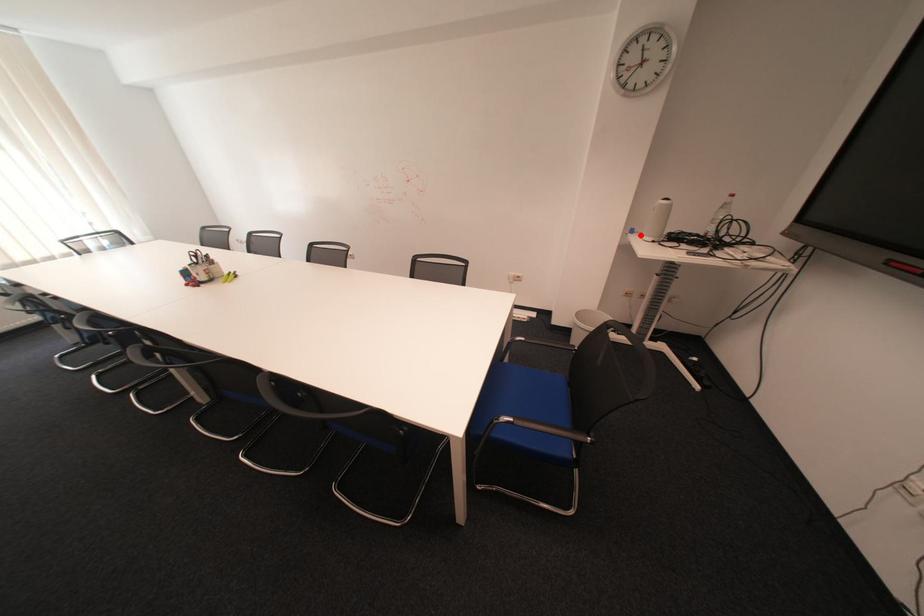
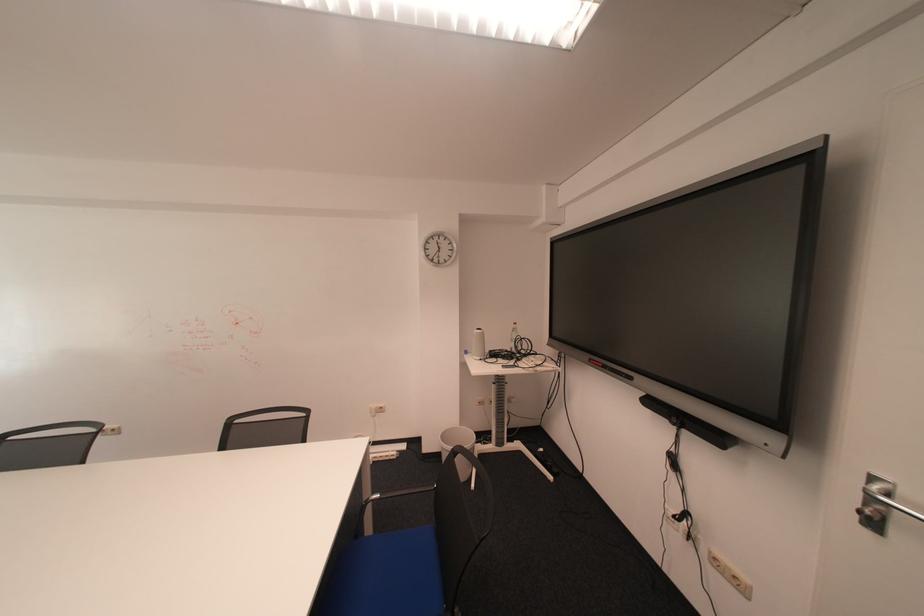
Locate, in the second image, the point that corresponds to the highlighted location in the first image.

(477, 355)